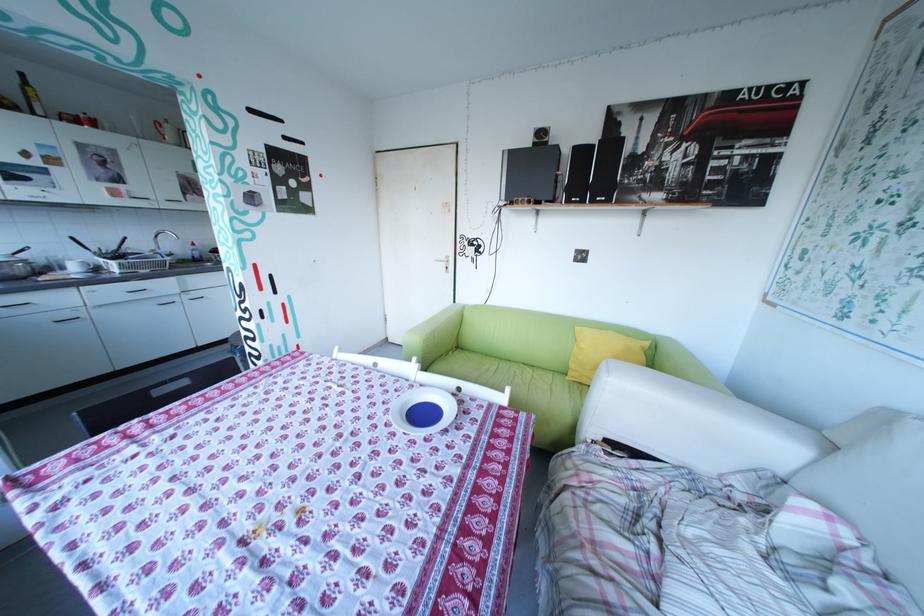
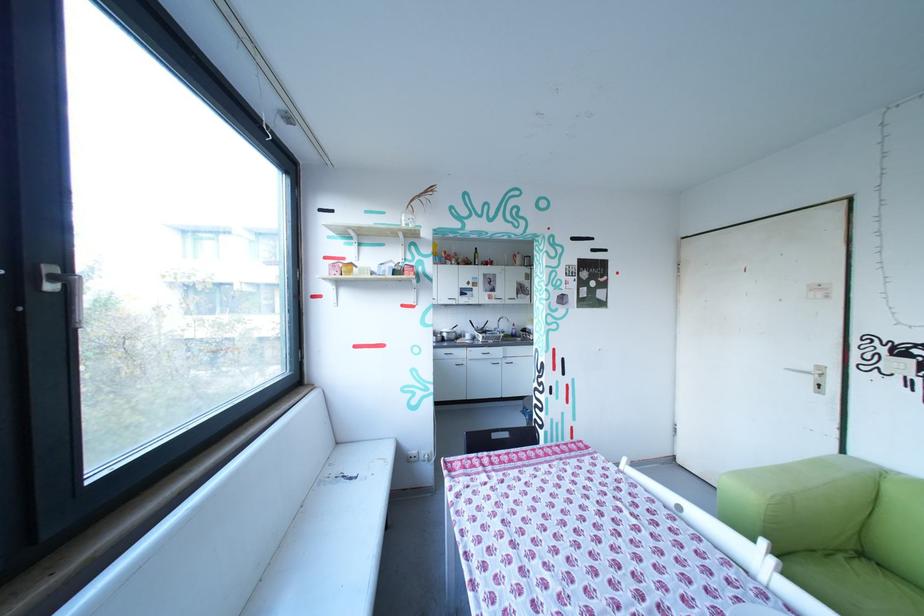
The point at [457,268] is marked in the first image. Where is the corresponding point in the second image?

(825, 385)